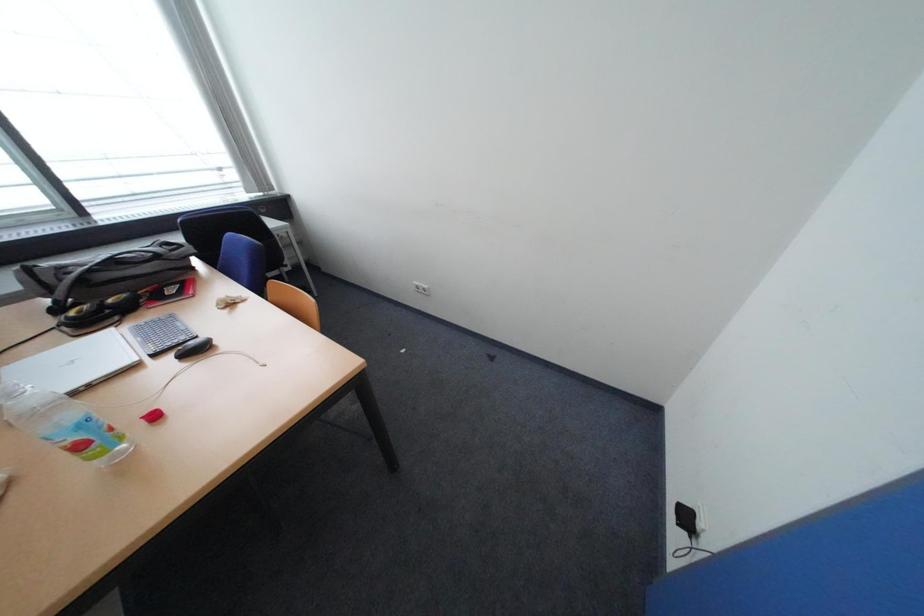
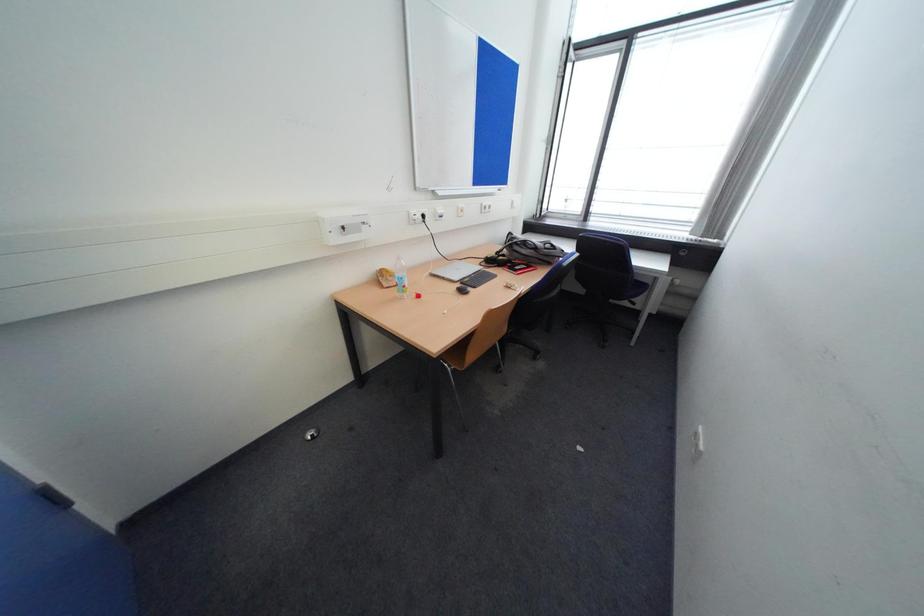
First-person continuous shooting, in which direction is the camera rotating?

The camera's rotation is toward left-down.